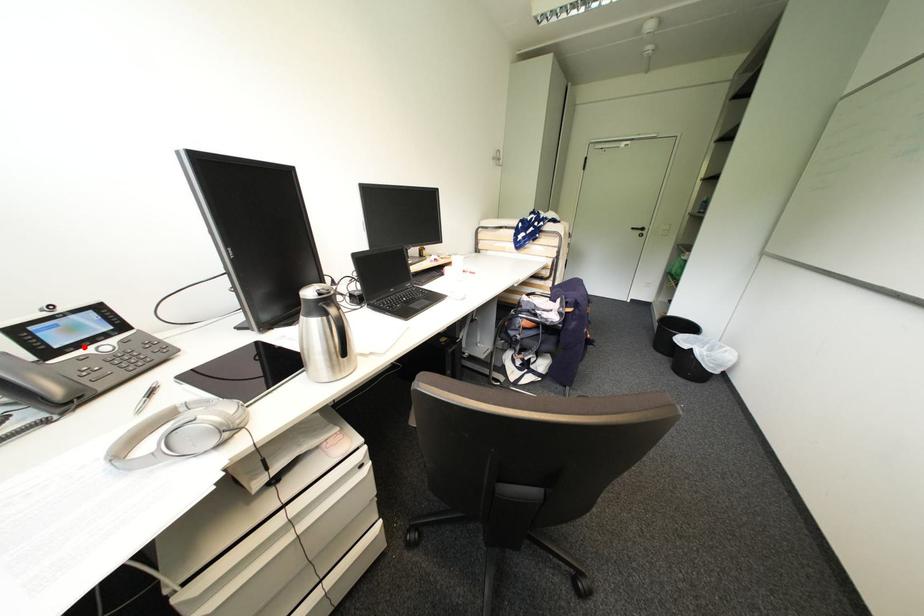
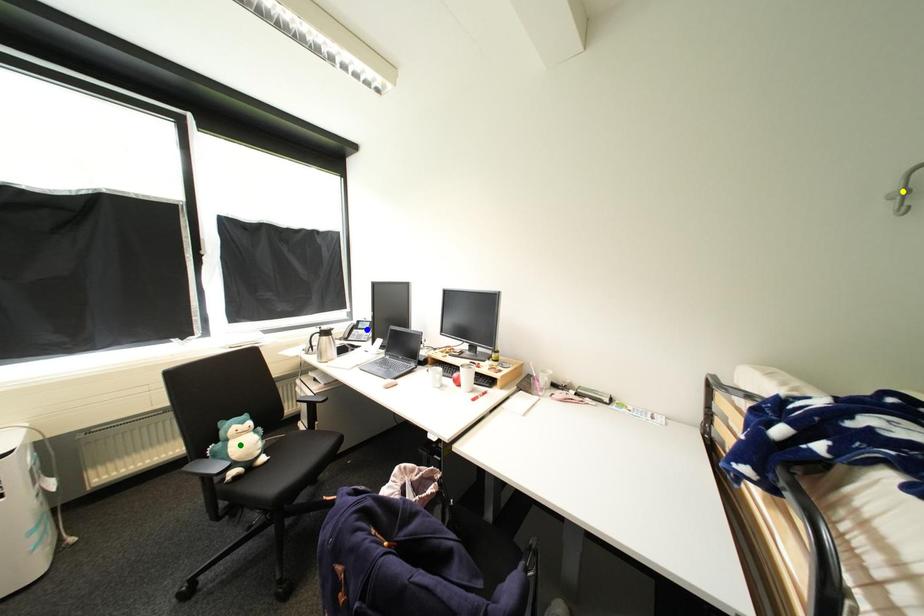
Question: I am providing you with two images of the same scene from different viewpoints. A red point is marked on the first image. You are given multiple points on the second image. Which mark in image 2 goes with the point in image 1?

Choices:
 (A) blue point
 (B) yellow point
 (C) green point

Answer: (A)